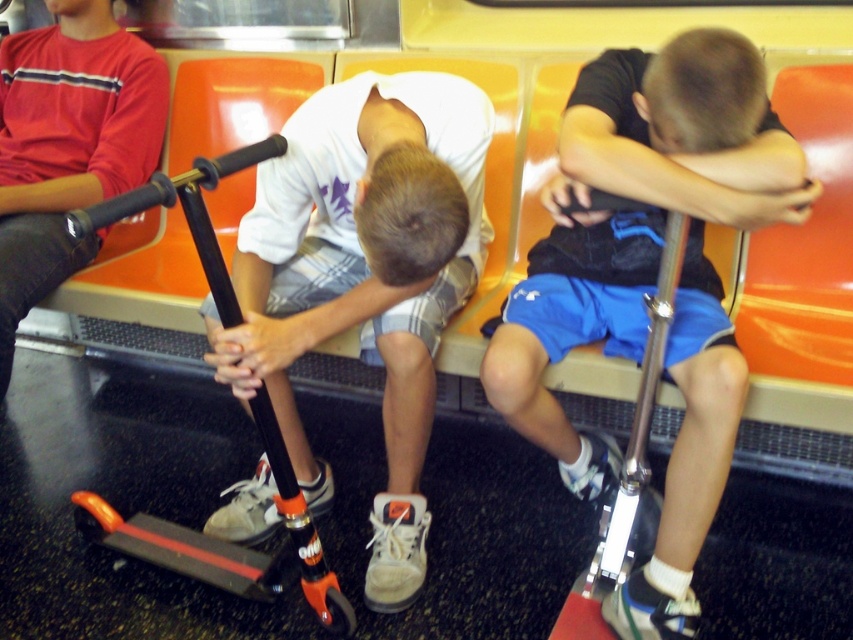
Is the white matte shirt at center located to the left or right of the point marked at coordinates [364,276]?

The white matte shirt at center is located exactly at the point marked at coordinates [364,276].

You are a passenger on this vehicle and want to place your backpack between the white matte shirt at center and the matte black scooter at lower left. Is there enough space between them to fit your backpack?

A: The white matte shirt at center is to the right of the matte black scooter at lower left, so there is space between them to place your backpack.

You are a passenger on a train and see the matte black scooter at lower left and the orange matte scooter at center. Which one is closer to the left side of the train?

The matte black scooter at lower left is closer to the left side of the train because it is positioned to the left of the orange matte scooter at center.